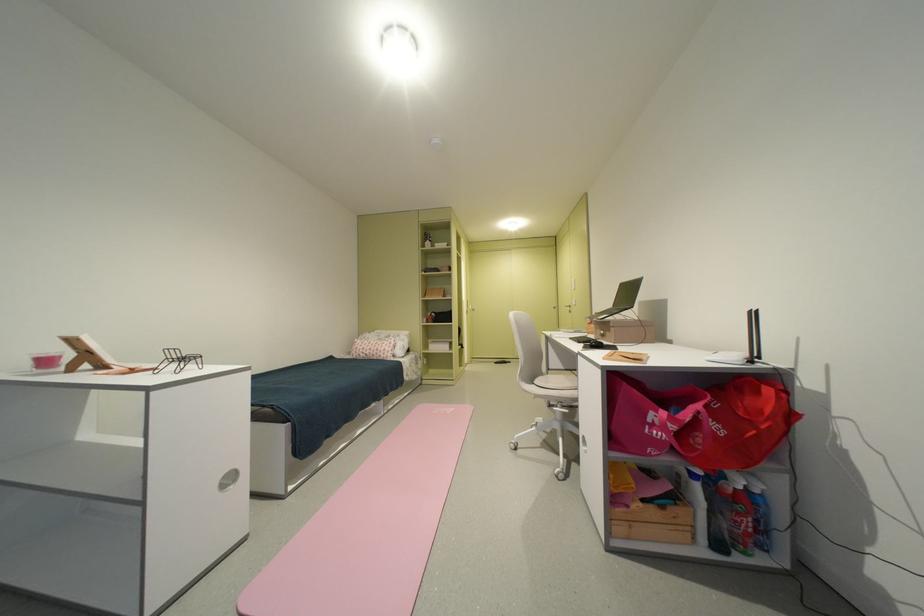
You are a GUI agent. You are given a task and a screenshot of the screen. Output one action in this format:
    pyautogui.click(x=<x>, y=<y>)
    Task: Click on the cabinet door handle
    This screenshot has height=616, width=924.
    Given the screenshot: What is the action you would take?
    227,480